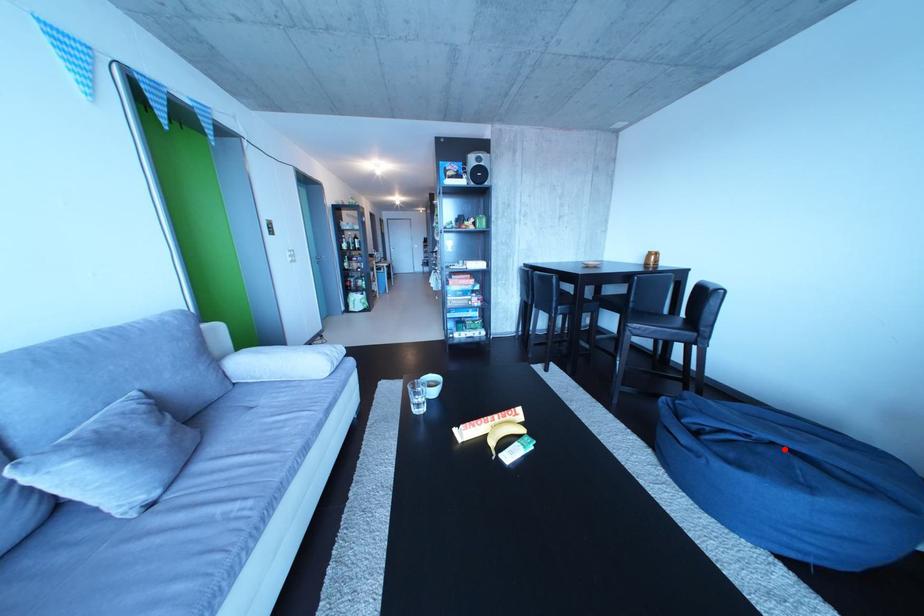
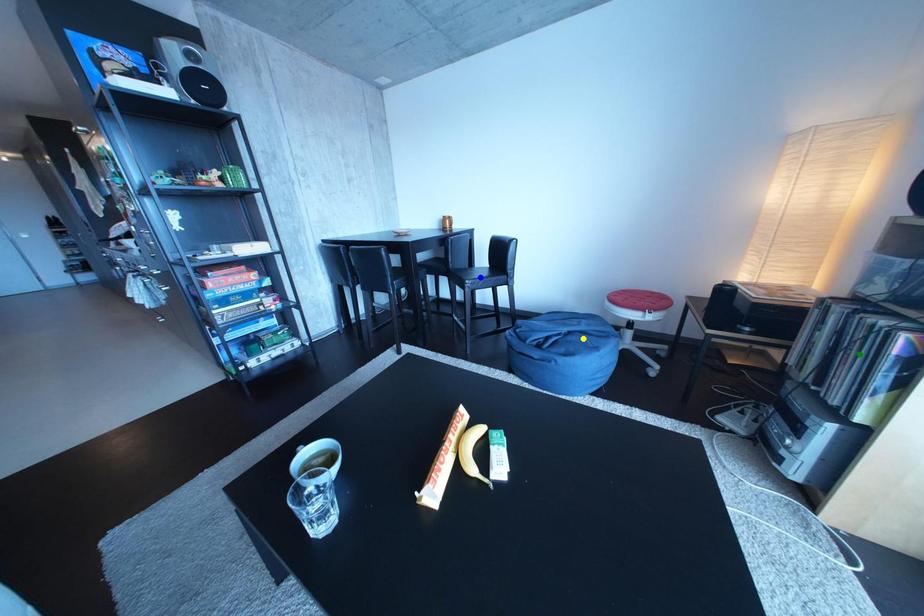
Question: I am providing you with two images of the same scene from different viewpoints. A red point is marked on the first image. You are given multiple points on the second image. Which point in image 2 represents the same 3d spot as the red point in image 1?

Choices:
 (A) yellow point
 (B) blue point
 (C) green point

Answer: (A)